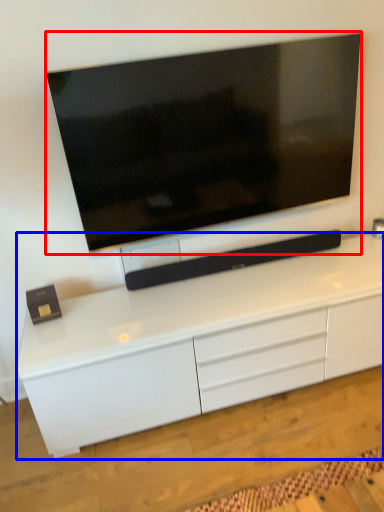
Question: Among these objects, which one is nearest to the camera, television (highlighted by a red box) or cabinetry (highlighted by a blue box)?

Choices:
 (A) television
 (B) cabinetry

Answer: (B)